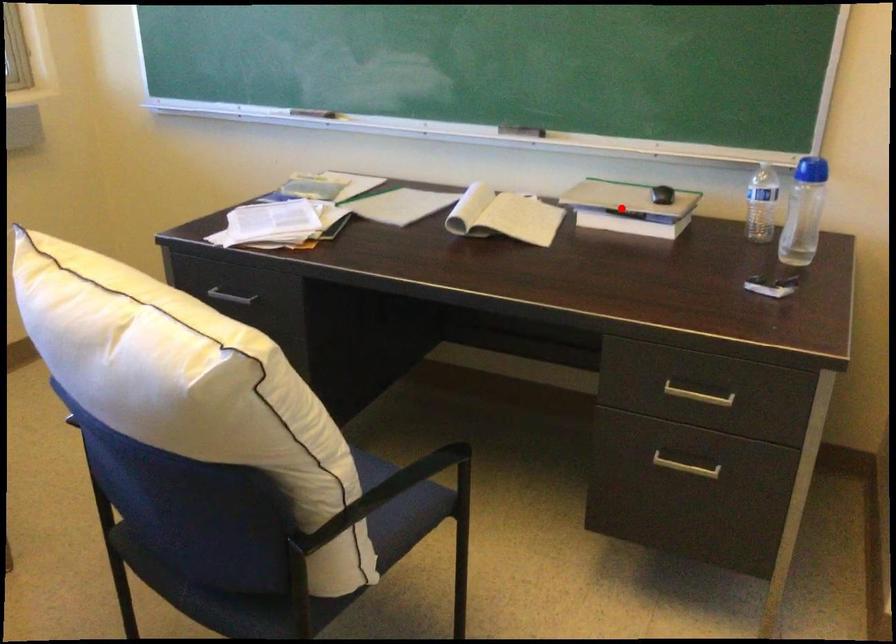
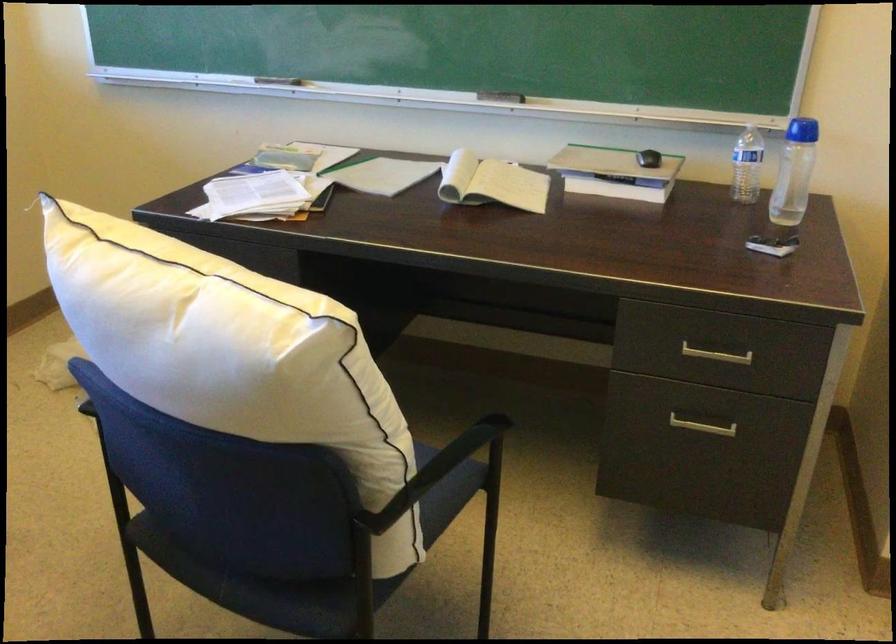
Locate, in the second image, the point that corresponds to the highlighted location in the first image.

(615, 173)